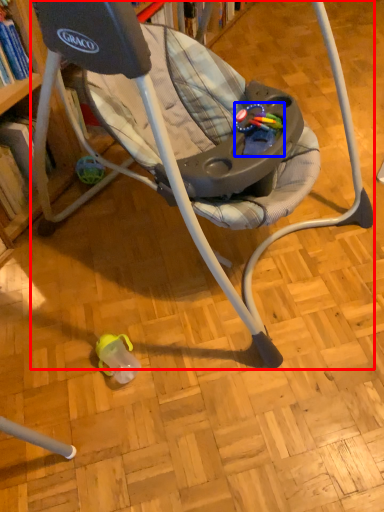
Question: Which of the following is the farthest to the observer, chair (highlighted by a red box) or toy (highlighted by a blue box)?

Choices:
 (A) chair
 (B) toy

Answer: (B)